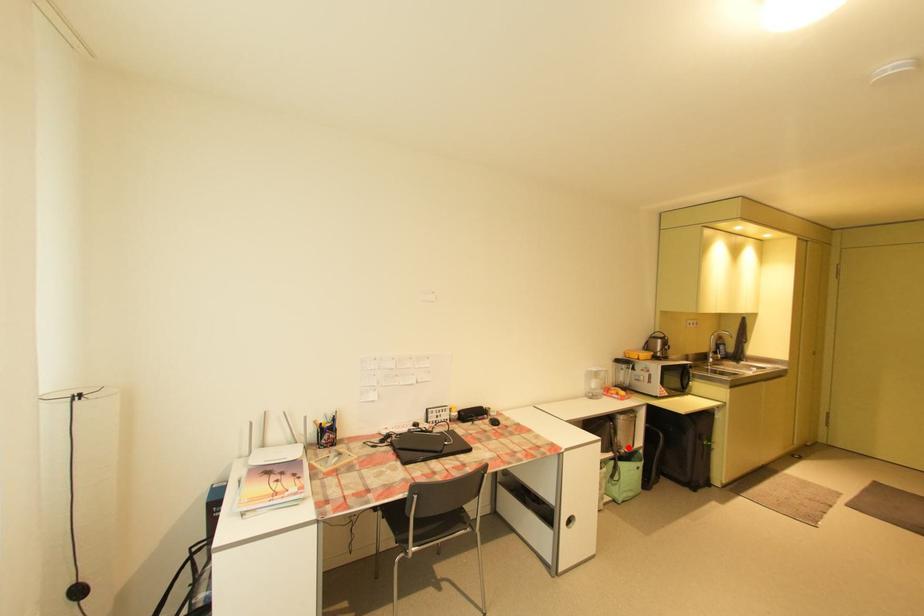
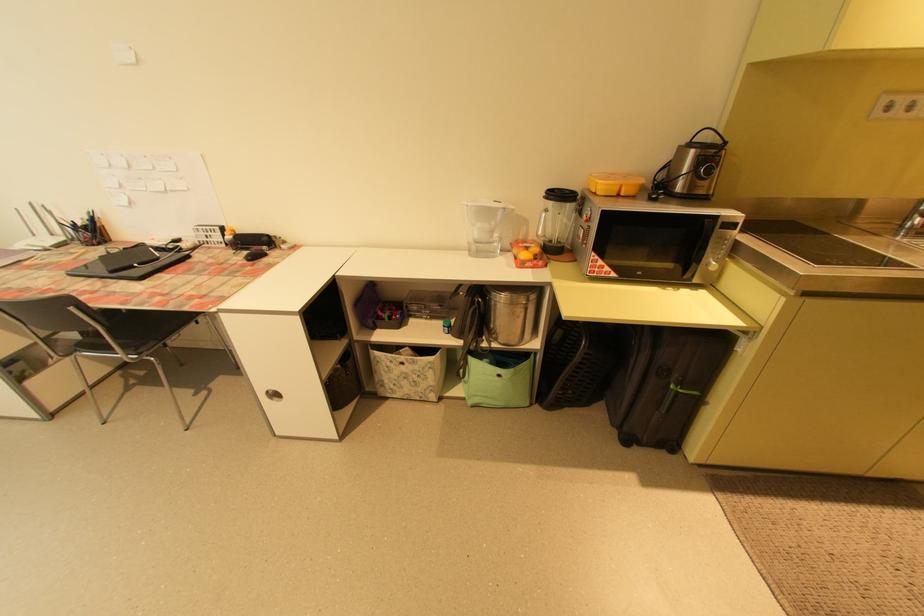
Locate, in the second image, the point that corresponds to the highlighted location in the first image.

(503, 339)